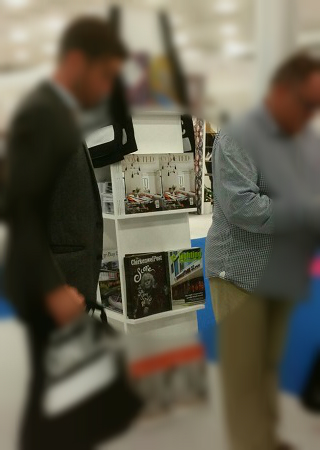
Find the location of a particular element. ivory covered book is located at coordinates (146, 178).